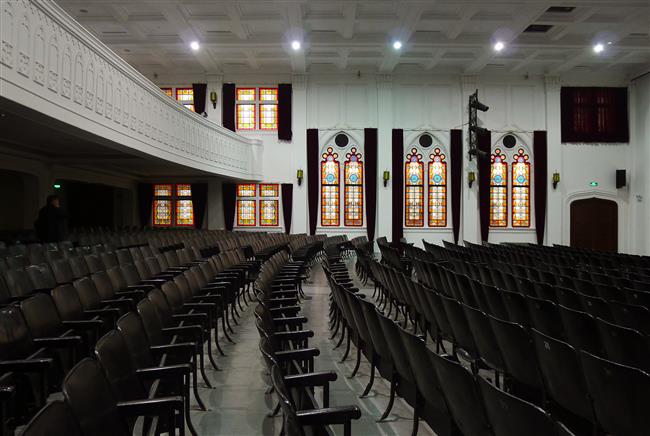
Where is `wall sconces`? This screenshot has height=436, width=650. wall sconces is located at coordinates (556, 178), (470, 174), (385, 173), (296, 171).